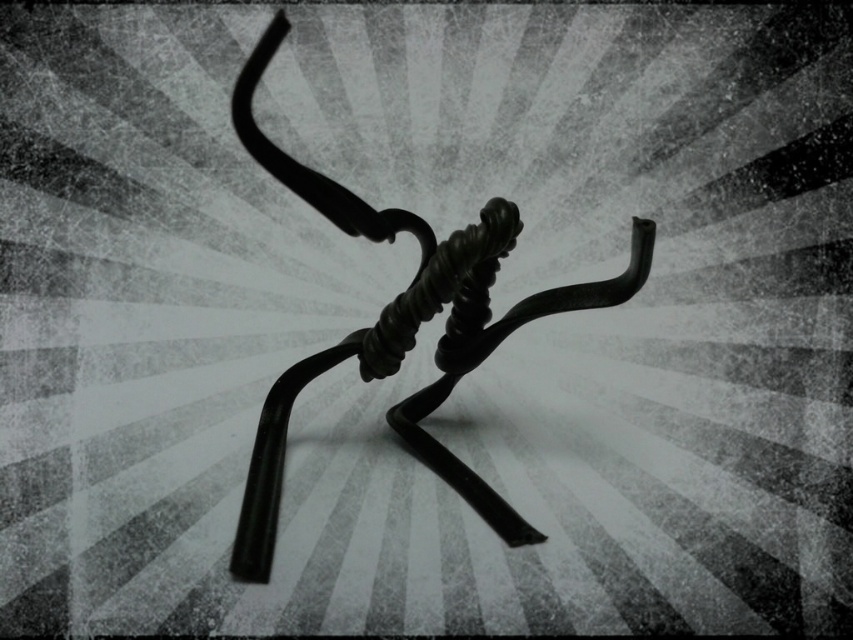
Question: Which of the following is the closest to the observer?

Choices:
 (A) black matte wire sculpture at center
 (B) black rubber knot at center

Answer: (A)

Question: Which of the following is the closest to the observer?

Choices:
 (A) black matte wire sculpture at center
 (B) black rubber knot at center

Answer: (A)

Question: Does black matte wire sculpture at center appear under black rubber knot at center?

Choices:
 (A) yes
 (B) no

Answer: (B)

Question: Where is black matte wire sculpture at center located in relation to black rubber knot at center in the image?

Choices:
 (A) above
 (B) below

Answer: (A)

Question: Can you confirm if black matte wire sculpture at center is smaller than black rubber knot at center?

Choices:
 (A) no
 (B) yes

Answer: (A)